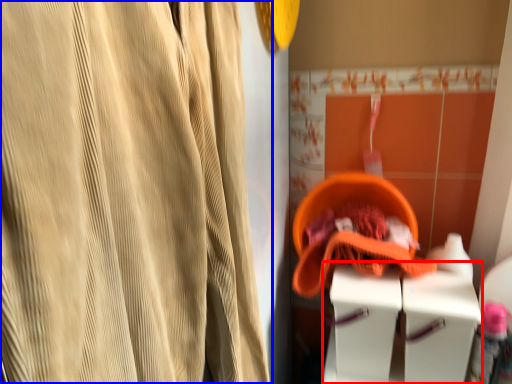
Question: Which object is closer to the camera taking this photo, vanity (highlighted by a red box) or curtain (highlighted by a blue box)?

Choices:
 (A) vanity
 (B) curtain

Answer: (B)